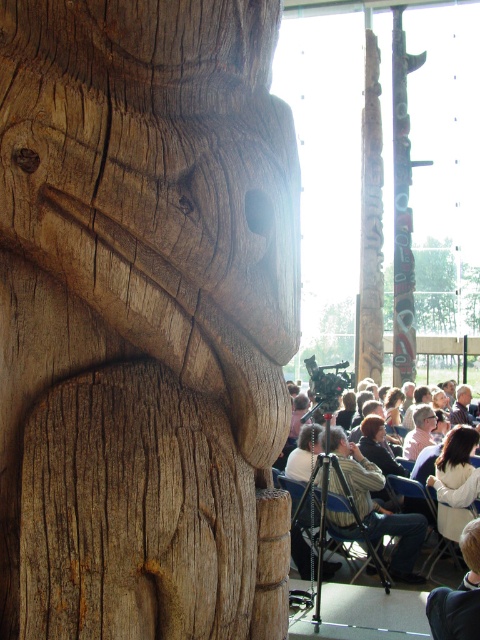
Question: Does natural wood totem pole at center appear over matte wooden crowd at center?

Choices:
 (A) no
 (B) yes

Answer: (B)

Question: Can you confirm if natural wood totem pole at center is positioned to the right of light brown wood carving at lower right?

Choices:
 (A) no
 (B) yes

Answer: (A)

Question: Which is farther from the natural wood totem pole at center?

Choices:
 (A) light brown wood carving at lower right
 (B) light brown wood chair at center
 (C) matte wooden crowd at center
 (D) carved wood totem pole at center

Answer: (D)

Question: Which point is closer to the camera?

Choices:
 (A) matte wooden crowd at center
 (B) light brown wood carving at lower right
 (C) natural wood totem pole at center

Answer: (C)

Question: Which of the following is the farthest from the observer?

Choices:
 (A) matte wooden crowd at center
 (B) light brown wood chair at center
 (C) natural wood totem pole at center
 (D) light brown wood carving at lower right

Answer: (B)

Question: Is natural wood totem pole at center positioned before light brown wood chair at center?

Choices:
 (A) yes
 (B) no

Answer: (A)